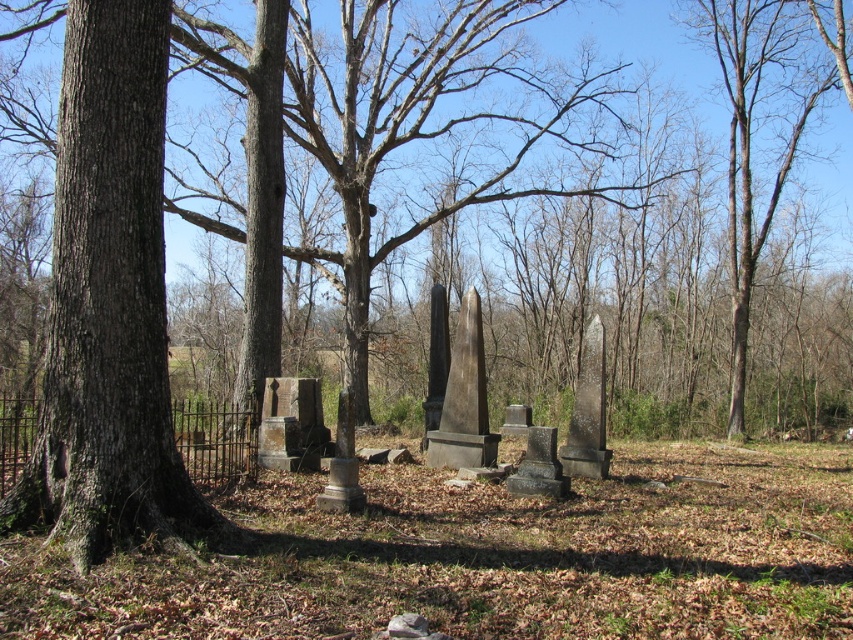
Can you confirm if brown rough bark tree at left is positioned to the right of brown bark tree at right?

Incorrect, brown rough bark tree at left is not on the right side of brown bark tree at right.

Which is behind, point (105, 163) or point (747, 236)?

Point (747, 236)

Where is `brown rough bark tree at left`? The width and height of the screenshot is (853, 640). brown rough bark tree at left is located at coordinates (109, 307).